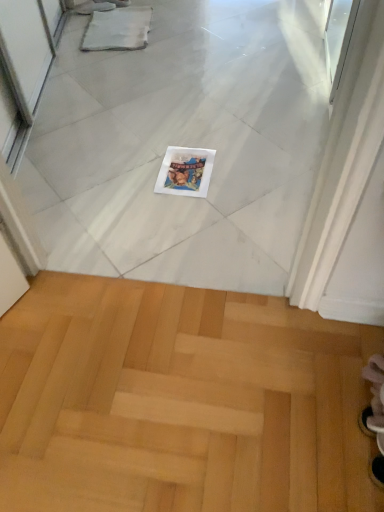
Question: Should I look upward or downward to see light wood parquet floor at lower center?

Choices:
 (A) up
 (B) down

Answer: (B)

Question: Is light wood parquet floor at lower center completely or partially inside white glossy magazine at center?

Choices:
 (A) yes
 (B) no

Answer: (B)

Question: Is white glossy magazine at center shorter than light wood parquet floor at lower center?

Choices:
 (A) yes
 (B) no

Answer: (A)

Question: Is white glossy magazine at center far away from light wood parquet floor at lower center?

Choices:
 (A) no
 (B) yes

Answer: (A)

Question: Is the depth of white glossy magazine at center greater than that of light wood parquet floor at lower center?

Choices:
 (A) no
 (B) yes

Answer: (B)

Question: From a real-world perspective, is white glossy magazine at center located beneath light wood parquet floor at lower center?

Choices:
 (A) no
 (B) yes

Answer: (A)

Question: From the image's perspective, does white glossy magazine at center appear lower than light wood parquet floor at lower center?

Choices:
 (A) yes
 (B) no

Answer: (B)

Question: Is light wood parquet floor at lower center taller than white glossy magazine at center?

Choices:
 (A) no
 (B) yes

Answer: (B)

Question: Does light wood parquet floor at lower center turn towards white glossy magazine at center?

Choices:
 (A) no
 (B) yes

Answer: (B)

Question: Considering the relative sizes of light wood parquet floor at lower center and white glossy magazine at center in the image provided, is light wood parquet floor at lower center thinner than white glossy magazine at center?

Choices:
 (A) yes
 (B) no

Answer: (B)

Question: From the image's perspective, does light wood parquet floor at lower center appear lower than white glossy magazine at center?

Choices:
 (A) yes
 (B) no

Answer: (A)

Question: Can you confirm if light wood parquet floor at lower center is positioned to the right of white glossy magazine at center?

Choices:
 (A) no
 (B) yes

Answer: (A)

Question: From a real-world perspective, is light wood parquet floor at lower center on top of white glossy magazine at center?

Choices:
 (A) no
 (B) yes

Answer: (A)

Question: Is white glossy magazine at center wider or thinner than light wood parquet floor at lower center?

Choices:
 (A) thin
 (B) wide

Answer: (A)